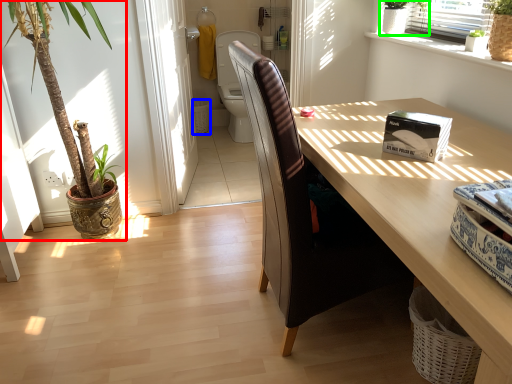
Question: Considering the real-world distances, which object is farthest from houseplant (highlighted by a red box)? basket (highlighted by a blue box) or houseplant (highlighted by a green box)?

Choices:
 (A) basket
 (B) houseplant

Answer: (A)